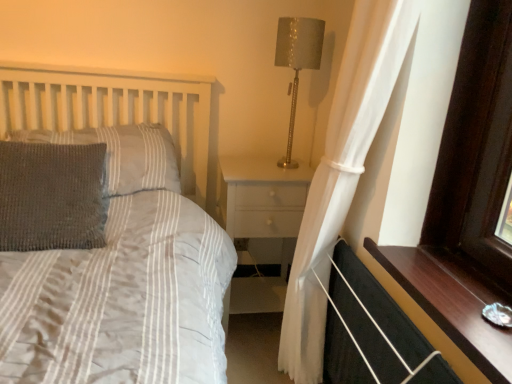
The image size is (512, 384). In order to click on vacant space that is to the left of metallic gold table lamp at upper right in this screenshot , I will do `click(250, 163)`.